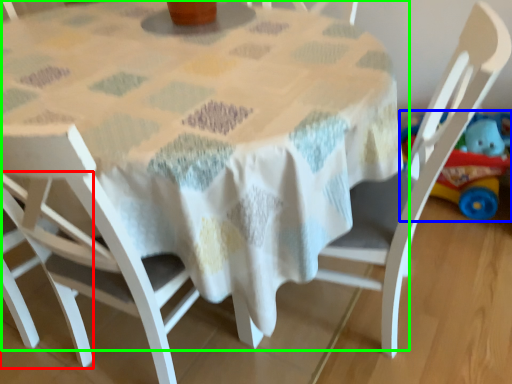
Question: Considering the real-world distances, which object is closest to chair (highlighted by a red box)? toy (highlighted by a blue box) or table (highlighted by a green box).

Choices:
 (A) toy
 (B) table

Answer: (B)